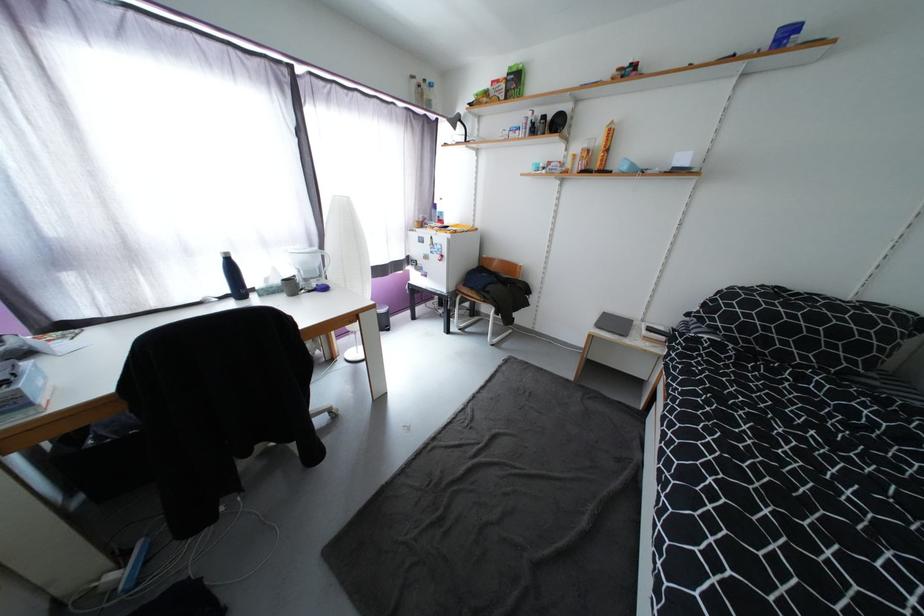
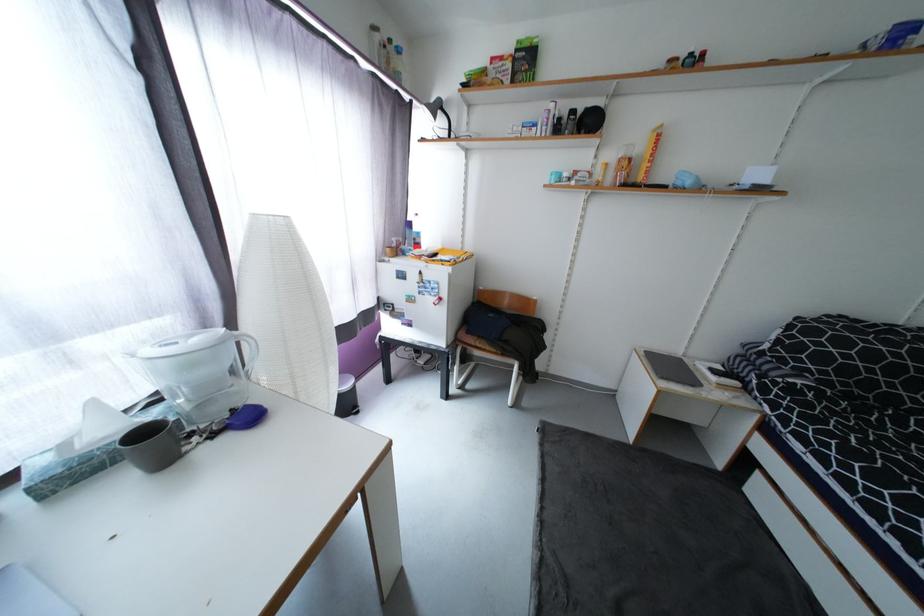
Where in the second image is the point corresponding to the point at 460,233 from the first image?

(460, 264)